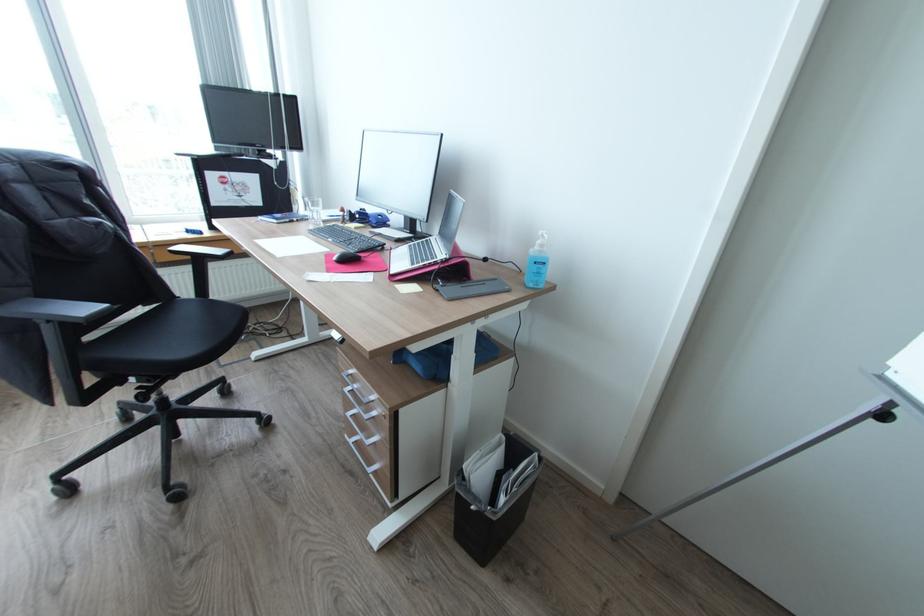
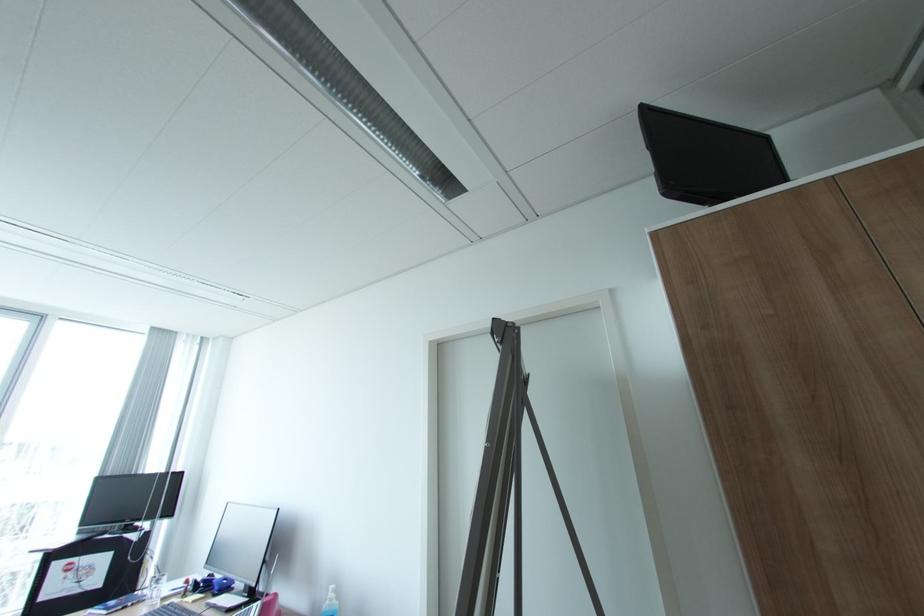
The point at [545,245] is marked in the first image. Where is the corresponding point in the second image?

(336, 599)